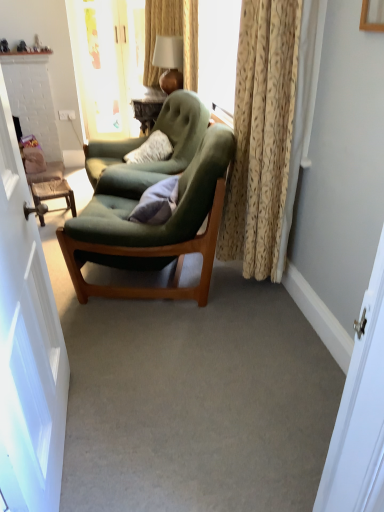
What is the approximate height of velvet green armchair at center, which is the first chair in back-to-front order?

The height of velvet green armchair at center, which is the first chair in back-to-front order, is 30.11 inches.

Identify the location of matte gold lamp at upper center. (169, 62).

The width and height of the screenshot is (384, 512). What do you see at coordinates (169, 62) in the screenshot?
I see `matte gold lamp at upper center` at bounding box center [169, 62].

What do you see at coordinates (261, 135) in the screenshot? The image size is (384, 512). I see `beige textured curtain at right` at bounding box center [261, 135].

Identify the location of velvet green armchair at center, the 2th chair viewed from the back. The image size is (384, 512). (154, 229).

The width and height of the screenshot is (384, 512). I want to click on transparent glass door at upper center, so click(x=104, y=66).

The image size is (384, 512). Describe the element at coordinates (157, 202) in the screenshot. I see `gray fabric pillow at center` at that location.

The width and height of the screenshot is (384, 512). In order to click on wooden textured stool at left in this screenshot , I will do `click(54, 193)`.

Between velvet green armchair at center, the 2th chair viewed from the back, and gray fabric pillow at center, which one has smaller size?

gray fabric pillow at center.

Can you confirm if velvet green armchair at center, the 1th chair from the front, is positioned to the right of gray fabric pillow at center?

In fact, velvet green armchair at center, the 1th chair from the front, is to the left of gray fabric pillow at center.

Does velvet green armchair at center, the 2th chair viewed from the back, lie behind gray fabric pillow at center?

No.

Considering the relative sizes of velvet green armchair at center, the 1th chair from the front, and gray fabric pillow at center in the image provided, is velvet green armchair at center, the 1th chair from the front, wider than gray fabric pillow at center?

Yes, velvet green armchair at center, the 1th chair from the front, is wider than gray fabric pillow at center.

This screenshot has height=512, width=384. Find the location of `pillow lying below the wooden textured stool at left (from the image's perspective)`. pillow lying below the wooden textured stool at left (from the image's perspective) is located at coordinates (157, 202).

Consider the image. Does gray fabric pillow at center contain wooden textured stool at left?

That's incorrect, wooden textured stool at left is not inside gray fabric pillow at center.

Considering the sizes of objects gray fabric pillow at center and wooden textured stool at left in the image provided, who is bigger, gray fabric pillow at center or wooden textured stool at left?

gray fabric pillow at center is bigger.

Is wooden textured stool at left wider than transparent glass door at upper center?

Correct, the width of wooden textured stool at left exceeds that of transparent glass door at upper center.

From the image's perspective, between wooden textured stool at left and transparent glass door at upper center, who is located below?

wooden textured stool at left is shown below in the image.

Is wooden textured stool at left surrounding transparent glass door at upper center?

No, transparent glass door at upper center is not inside wooden textured stool at left.

In the scene shown: Considering the relative sizes of white glossy door at left and transparent glass door at upper center in the image provided, is white glossy door at left smaller than transparent glass door at upper center?

No, white glossy door at left is not smaller than transparent glass door at upper center.

Which object is positioned more to the left, white glossy door at left or transparent glass door at upper center?

transparent glass door at upper center.

From a real-world perspective, who is located higher, white glossy door at left or transparent glass door at upper center?

transparent glass door at upper center, from a real-world perspective.

I want to click on glass door above the white glossy door at left (from the image's perspective), so click(x=104, y=66).

Is gray fabric pillow at center facing away from white glossy door at left?

gray fabric pillow at center does not have its back to white glossy door at left.

From the image's perspective, is gray fabric pillow at center below white glossy door at left?

No, from the image's perspective, gray fabric pillow at center is not beneath white glossy door at left.

From a real-world perspective, who is located lower, gray fabric pillow at center or white glossy door at left?

From a 3D spatial view, gray fabric pillow at center is below.

Is gray fabric pillow at center in front of white glossy door at left?

No, it is not.

From a real-world perspective, is velvet green armchair at center, the 2th chair from the front, physically above velvet green armchair at center, the 2th chair viewed from the back?

Yes, from a real-world perspective, velvet green armchair at center, the 2th chair from the front, is over velvet green armchair at center, the 2th chair viewed from the back

Is velvet green armchair at center, which is the first chair in back-to-front order, not within velvet green armchair at center, the 1th chair from the front?

velvet green armchair at center, which is the first chair in back-to-front order, is positioned outside velvet green armchair at center, the 1th chair from the front.

Can you tell me how much velvet green armchair at center, which is the first chair in back-to-front order, and velvet green armchair at center, the 2th chair viewed from the back, differ in facing direction?

The angle between the facing direction of velvet green armchair at center, which is the first chair in back-to-front order, and the facing direction of velvet green armchair at center, the 2th chair viewed from the back, is 26.2 degrees.

Considering the positions of point (116, 143) and point (201, 302), is point (116, 143) closer or farther from the camera than point (201, 302)?

Point (116, 143) appears to be farther away from the viewer than point (201, 302).

Looking at this image, is transparent glass door at upper center located outside wooden textured stool at left?

That's correct, transparent glass door at upper center is outside of wooden textured stool at left.

From a real-world perspective, is transparent glass door at upper center physically above wooden textured stool at left?

Yes, from a real-world perspective, transparent glass door at upper center is above wooden textured stool at left.

Does point (122, 42) come behind point (37, 204)?

That is True.

Find the location of `pillow located behind the velvet green armchair at center, the 1th chair from the front`. pillow located behind the velvet green armchair at center, the 1th chair from the front is located at coordinates (157, 202).

In the image, there is a wooden textured stool at left. Where is `pillow below it (from the image's perspective)`? This screenshot has height=512, width=384. pillow below it (from the image's perspective) is located at coordinates (157, 202).

Looking at the image, which one is located closer to wooden textured stool at left, beige textured curtain at right or transparent glass door at upper center?

beige textured curtain at right is positioned closer to the anchor wooden textured stool at left.

Estimate the real-world distances between objects in this image. Which object is further from gray fabric pillow at center, matte gold lamp at upper center or beige textured curtain at right?

Among the two, matte gold lamp at upper center is located further to gray fabric pillow at center.

Looking at the image, which one is located further to matte gold lamp at upper center, white glossy door at left or velvet green armchair at center, the 2th chair viewed from the back?

white glossy door at left is positioned further to the anchor matte gold lamp at upper center.

From the image, which object appears to be nearer to matte gold lamp at upper center, velvet green armchair at center, the 1th chair from the front, or transparent glass door at upper center?

transparent glass door at upper center is closer to matte gold lamp at upper center.

When comparing their distances from velvet green armchair at center, the 2th chair viewed from the back, does beige textured curtain at right or gray fabric pillow at center seem further?

Based on the image, beige textured curtain at right appears to be further to velvet green armchair at center, the 2th chair viewed from the back.

From the image, which object appears to be farther from velvet green armchair at center, the 2th chair viewed from the back, gray fabric pillow at center or beige textured curtain at right?

The object further to velvet green armchair at center, the 2th chair viewed from the back, is beige textured curtain at right.

Based on the photo, which object lies further to the anchor point velvet green armchair at center, the 2th chair from the front, transparent glass door at upper center or matte gold lamp at upper center?

transparent glass door at upper center lies further to velvet green armchair at center, the 2th chair from the front, than the other object.

Which object lies nearer to the anchor point matte gold lamp at upper center, wooden textured stool at left or white glossy door at left?

wooden textured stool at left lies closer to matte gold lamp at upper center than the other object.

Where is `chair between transparent glass door at upper center and wooden textured stool at left in the vertical direction`? This screenshot has width=384, height=512. chair between transparent glass door at upper center and wooden textured stool at left in the vertical direction is located at coordinates (144, 141).

The height and width of the screenshot is (512, 384). Identify the location of chair between matte gold lamp at upper center and gray fabric pillow at center vertically. (144, 141).

This screenshot has width=384, height=512. I want to click on pillow between beige textured curtain at right and matte gold lamp at upper center from front to back, so (157, 202).

Image resolution: width=384 pixels, height=512 pixels. Identify the location of chair positioned between gray fabric pillow at center and wooden textured stool at left from near to far. (144, 141).